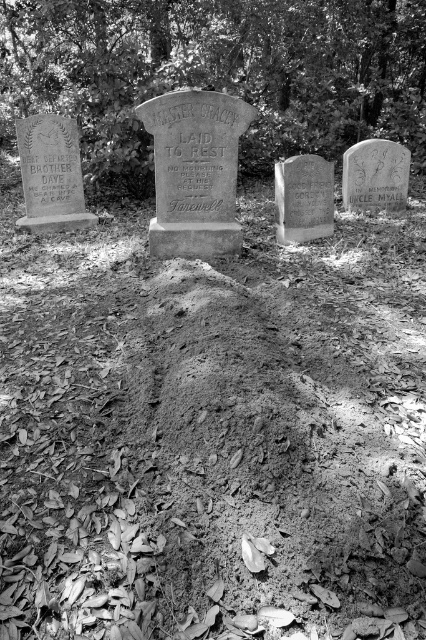
You are a gardener who needs to water both the smooth bark tree at upper center and the smooth stone gravestone at center. Your watering can has a capacity of 1.8 liters and you can carry it 2 meters before needing to refill. How many times will you need to refill your watering can to water both objects starting from the gravestone?

The distance between the smooth bark tree at upper center and the smooth stone gravestone at center is 2.20 meters. Since the watering can can be carried 2 meters before needing to refill, you will need to refill it at least once to reach the tree from the gravestone.

You are standing at the edge of the cemetery and want to take a photo of the smooth bark tree at upper center and the smooth stone gravestone at center. Which object will appear larger in your photo?

The smooth stone gravestone at center will appear larger in the photo because it is larger than the smooth bark tree at upper center.

You are standing at the edge of the cemetery and see the smooth bark tree at upper center and the smooth gray stone gravestone at center. Which object is higher up in the image?

The smooth bark tree at upper center is above the smooth gray stone gravestone at center, so it is higher up in the image.